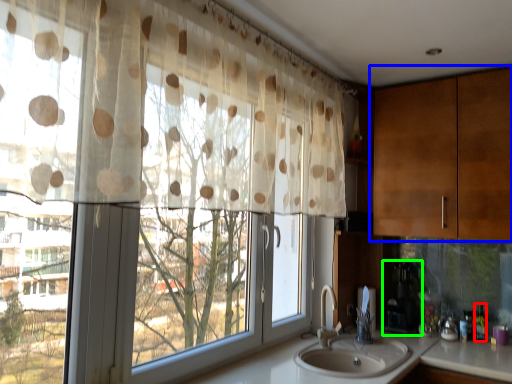
Question: Based on their relative distances, which object is nearer to bottle (highlighted by a red box)? Choose from cabinetry (highlighted by a blue box) and appliance (highlighted by a green box).

Choices:
 (A) cabinetry
 (B) appliance

Answer: (B)